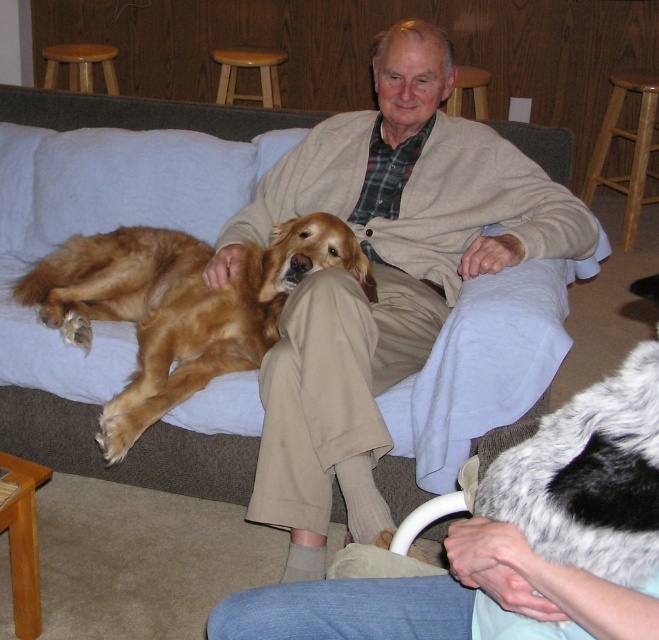
Question: Among these points, which one is nearest to the camera?

Choices:
 (A) [72, 65]
 (B) [45, 452]
 (C) [480, 90]
 (D) [127, 396]

Answer: (D)

Question: Does light brown wooden stool at upper center come behind wooden stool at upper center?

Choices:
 (A) no
 (B) yes

Answer: (B)

Question: From the image, what is the correct spatial relationship of soft gray couch at center in relation to wooden stool at upper center?

Choices:
 (A) right
 (B) left

Answer: (B)

Question: Which point is farther from the camera taking this photo?

Choices:
 (A) (217, 348)
 (B) (235, 60)

Answer: (B)

Question: Is gray and white fur at lower right to the right of light brown wooden stool at upper left from the viewer's perspective?

Choices:
 (A) no
 (B) yes

Answer: (B)

Question: Which of these objects is positioned farthest from the soft gray couch at center?

Choices:
 (A) wooden stool at upper center
 (B) light brown wooden stool at upper center
 (C) light brown wooden stool at upper left
 (D) golden fur dog at center

Answer: (C)